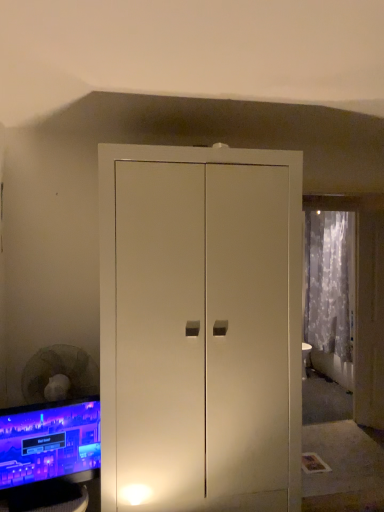
Question: Can you confirm if translucent fabric curtain at right is thinner than matte black monitor at lower left?

Choices:
 (A) yes
 (B) no

Answer: (B)

Question: Considering the relative sizes of translucent fabric curtain at right and matte black monitor at lower left in the image provided, is translucent fabric curtain at right bigger than matte black monitor at lower left?

Choices:
 (A) no
 (B) yes

Answer: (B)

Question: Does translucent fabric curtain at right appear on the right side of matte black monitor at lower left?

Choices:
 (A) yes
 (B) no

Answer: (A)

Question: Is translucent fabric curtain at right turned away from matte black monitor at lower left?

Choices:
 (A) yes
 (B) no

Answer: (B)

Question: From a real-world perspective, is translucent fabric curtain at right under matte black monitor at lower left?

Choices:
 (A) no
 (B) yes

Answer: (A)

Question: Can you confirm if translucent fabric curtain at right is taller than matte black monitor at lower left?

Choices:
 (A) no
 (B) yes

Answer: (B)

Question: Is matte black monitor at lower left far away from translucent fabric curtain at right?

Choices:
 (A) no
 (B) yes

Answer: (B)

Question: Would you say translucent fabric curtain at right is part of matte black monitor at lower left's contents?

Choices:
 (A) no
 (B) yes

Answer: (A)

Question: Is matte black monitor at lower left closer to camera compared to translucent fabric curtain at right?

Choices:
 (A) yes
 (B) no

Answer: (A)

Question: Is matte black monitor at lower left taller than translucent fabric curtain at right?

Choices:
 (A) yes
 (B) no

Answer: (B)

Question: Could you tell me if matte black monitor at lower left is turned towards translucent fabric curtain at right?

Choices:
 (A) yes
 (B) no

Answer: (B)

Question: Is matte black monitor at lower left placed right next to translucent fabric curtain at right?

Choices:
 (A) no
 (B) yes

Answer: (A)

Question: Considering the positions of point (307, 340) and point (86, 507), is point (307, 340) closer or farther from the camera than point (86, 507)?

Choices:
 (A) farther
 (B) closer

Answer: (A)